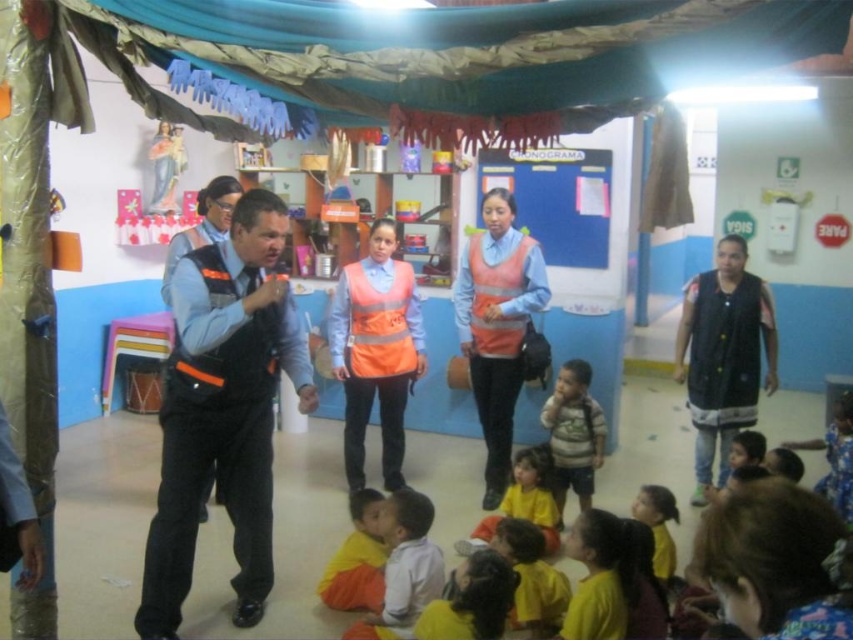
You are standing in the classroom and need to locate the black fabric vest at right. According to the coordinates provided, where should you look to find it?

The black fabric vest at right is located at coordinates point (723, 355).